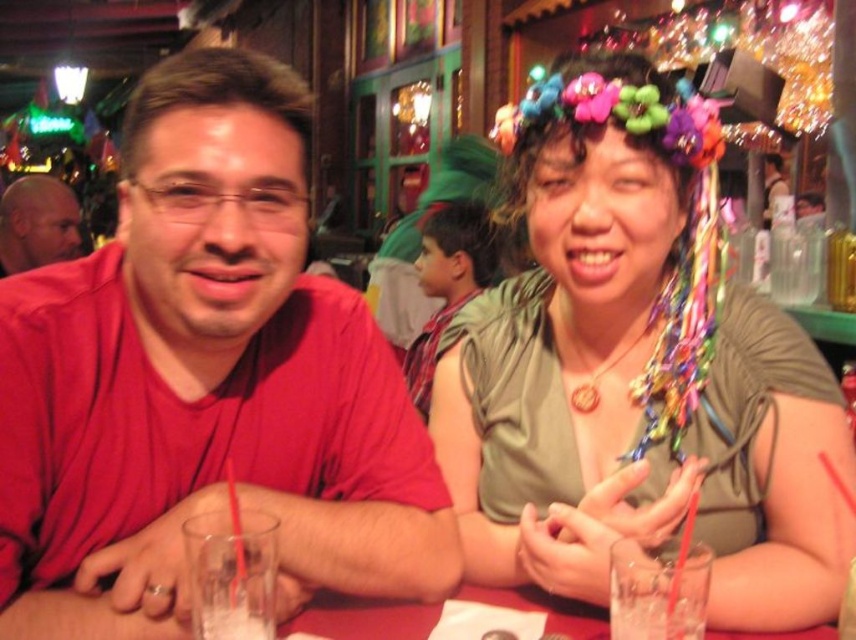
Can you confirm if translucent glass at lower right is positioned above clear glass at lower left?

Yes.

Is translucent glass at lower right below clear glass at lower left?

Actually, translucent glass at lower right is above clear glass at lower left.

Is point (696, 612) farther from viewer compared to point (230, 637)?

No, it is in front of (230, 637).

You are a GUI agent. You are given a task and a screenshot of the screen. Output one action in this format:
    pyautogui.click(x=<x>, y=<y>)
    Task: Click on the translucent glass at lower right
    Image resolution: width=856 pixels, height=640 pixels.
    Given the screenshot: What is the action you would take?
    pyautogui.click(x=657, y=616)

Is point (418, 339) less distant than point (195, 630)?

No, it is behind (195, 630).

Is green fabric shirt at center positioned before clear glass at lower left?

That is False.

Identify the location of green fabric shirt at center. The height and width of the screenshot is (640, 856). (447, 282).

Between green matte shirt at center and bald head at left, which one is positioned higher?

bald head at left is above.

Is green matte shirt at center positioned in front of bald head at left?

Yes, green matte shirt at center is in front of bald head at left.

Identify the location of green matte shirt at center. This screenshot has height=640, width=856. (635, 371).